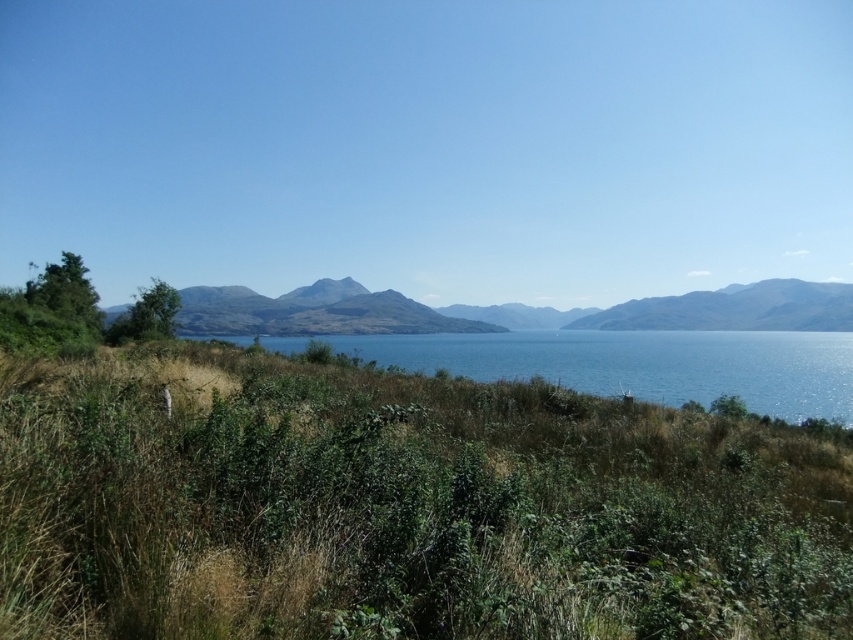
Question: Considering the relative positions of green grassy at lower center and blue water at center in the image provided, where is green grassy at lower center located with respect to blue water at center?

Choices:
 (A) above
 (B) below

Answer: (A)

Question: Which point is farther to the camera?

Choices:
 (A) smooth gray mountain at center
 (B) blue water at center

Answer: (A)

Question: Which object is the closest to the blue water at center?

Choices:
 (A) green grassy at lower center
 (B) smooth gray mountain at center

Answer: (B)

Question: Which is farther from the smooth gray mountain at center?

Choices:
 (A) blue water at center
 (B) green grassy at lower center

Answer: (B)

Question: Is green grassy at lower center positioned in front of blue water at center?

Choices:
 (A) yes
 (B) no

Answer: (A)

Question: Does green grassy at lower center have a lesser width compared to blue water at center?

Choices:
 (A) no
 (B) yes

Answer: (B)